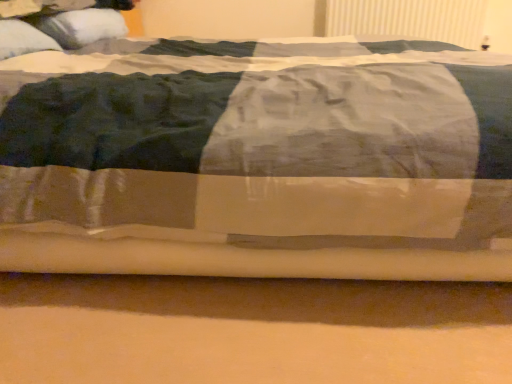
Question: Does white textured radiator at upper right lie behind white soft pillow at upper left, marked as the 1th pillow in a back-to-front arrangement?

Choices:
 (A) yes
 (B) no

Answer: (A)

Question: From the image's perspective, is white textured radiator at upper right over white soft pillow at upper left, which appears as the 2th pillow when viewed from the front?

Choices:
 (A) yes
 (B) no

Answer: (A)

Question: Is the depth of white textured radiator at upper right less than that of white soft pillow at upper left, which appears as the 2th pillow when viewed from the front?

Choices:
 (A) yes
 (B) no

Answer: (B)

Question: Is white textured radiator at upper right smaller than white soft pillow at upper left, marked as the 1th pillow in a back-to-front arrangement?

Choices:
 (A) yes
 (B) no

Answer: (A)

Question: Would you say white textured radiator at upper right is a long distance from white soft pillow at upper left, marked as the 1th pillow in a back-to-front arrangement?

Choices:
 (A) no
 (B) yes

Answer: (B)

Question: Is white textured radiator at upper right positioned beyond the bounds of white soft pillow at upper left, which appears as the 2th pillow when viewed from the front?

Choices:
 (A) yes
 (B) no

Answer: (A)

Question: Is white soft pillow at upper left, the first pillow from the front, taller than white soft pillow at upper left, marked as the 1th pillow in a back-to-front arrangement?

Choices:
 (A) no
 (B) yes

Answer: (B)

Question: From the image's perspective, does white soft pillow at upper left, the first pillow from the front, appear higher than white soft pillow at upper left, which appears as the 2th pillow when viewed from the front?

Choices:
 (A) yes
 (B) no

Answer: (B)

Question: Could you tell me if white soft pillow at upper left, the first pillow from the front, is facing white soft pillow at upper left, which appears as the 2th pillow when viewed from the front?

Choices:
 (A) yes
 (B) no

Answer: (B)

Question: Is white soft pillow at upper left, which appears as the second pillow when viewed from the back, directly adjacent to white soft pillow at upper left, marked as the 1th pillow in a back-to-front arrangement?

Choices:
 (A) no
 (B) yes

Answer: (A)

Question: From a real-world perspective, is white soft pillow at upper left, which appears as the second pillow when viewed from the back, positioned over white soft pillow at upper left, marked as the 1th pillow in a back-to-front arrangement, based on gravity?

Choices:
 (A) yes
 (B) no

Answer: (B)

Question: Considering the relative sizes of white soft pillow at upper left, the first pillow from the front, and white soft pillow at upper left, which appears as the 2th pillow when viewed from the front, in the image provided, is white soft pillow at upper left, the first pillow from the front, thinner than white soft pillow at upper left, which appears as the 2th pillow when viewed from the front,?

Choices:
 (A) no
 (B) yes

Answer: (B)

Question: From the image's perspective, is white soft pillow at upper left, marked as the 1th pillow in a back-to-front arrangement, under white textured radiator at upper right?

Choices:
 (A) yes
 (B) no

Answer: (A)